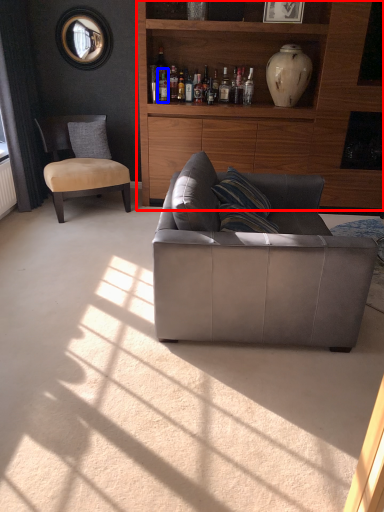
Question: Which object appears closest to the camera in this image, cabinetry (highlighted by a red box) or bottle (highlighted by a blue box)?

Choices:
 (A) cabinetry
 (B) bottle

Answer: (A)